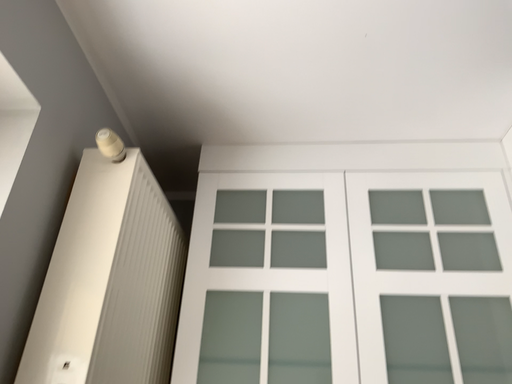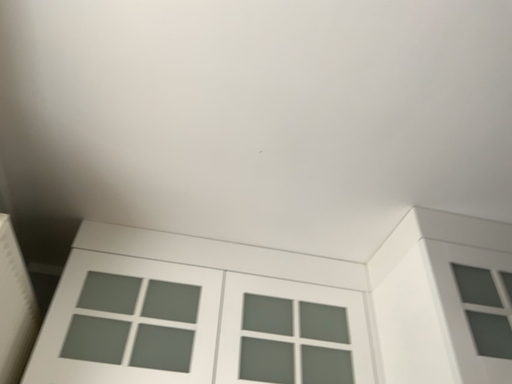
Question: Which way did the camera rotate in the video?

Choices:
 (A) rotated upward
 (B) rotated downward

Answer: (A)